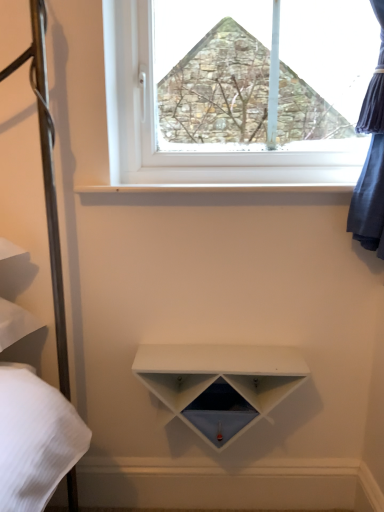
You are a GUI agent. You are given a task and a screenshot of the screen. Output one action in this format:
    pyautogui.click(x=<x>, y=<y>)
    Task: Click on the white plastic window at upper center
    The image size is (384, 512).
    Given the screenshot: What is the action you would take?
    pyautogui.click(x=237, y=90)

Does white smooth shelf at upper center come in front of white plastic window at upper center?

Yes, white smooth shelf at upper center is closer to the viewer.

Considering the relative positions of white smooth shelf at upper center and white plastic window at upper center in the image provided, is white smooth shelf at upper center to the left of white plastic window at upper center from the viewer's perspective?

Yes.

Is point (342, 188) more distant than point (291, 153)?

No.

From the image's perspective, is white smooth shelf at upper center on white plastic window at upper center?

No, from the image's perspective, white smooth shelf at upper center is not above white plastic window at upper center.

Which is more to the right, white matte shelf at center or white smooth shelf at upper center?

Positioned to the right is white smooth shelf at upper center.

This screenshot has width=384, height=512. Find the location of `shelf below the white smooth shelf at upper center (from a real-world perspective)`. shelf below the white smooth shelf at upper center (from a real-world perspective) is located at coordinates (219, 384).

From the image's perspective, between white plastic window at upper center and white matte shelf at center, who is located below?

From the image's view, white matte shelf at center is below.

In terms of height, does white plastic window at upper center look taller or shorter compared to white matte shelf at center?

white plastic window at upper center is taller than white matte shelf at center.

Considering the relative positions of white plastic window at upper center and white matte shelf at center in the image provided, is white plastic window at upper center in front of white matte shelf at center?

No.

At what (x,y) coordinates should I click in order to perform the action: click on shelf in front of the white plastic window at upper center. Please return your answer as a coordinate pair (x, y). The image size is (384, 512). Looking at the image, I should click on (219, 384).

Is white matte shelf at center spatially inside white plastic window at upper center, or outside of it?

white matte shelf at center cannot be found inside white plastic window at upper center.

Is white matte shelf at center to the left of white plastic window at upper center from the viewer's perspective?

Yes.

Is white matte shelf at center in front of or behind white plastic window at upper center in the image?

Clearly, white matte shelf at center is in front of white plastic window at upper center.

From a real-world perspective, is white matte shelf at center below white plastic window at upper center?

Yes, from a real-world perspective, white matte shelf at center is below white plastic window at upper center.

Which object is more forward, white smooth shelf at upper center or white matte shelf at center?

white matte shelf at center.

The width and height of the screenshot is (384, 512). In order to click on shelf located underneath the white smooth shelf at upper center (from a real-world perspective) in this screenshot , I will do `click(219, 384)`.

How much distance is there between white plastic window at upper center and white smooth shelf at upper center?

white plastic window at upper center is 10.82 inches from white smooth shelf at upper center.

Which of these two, white plastic window at upper center or white smooth shelf at upper center, stands taller?

Standing taller between the two is white plastic window at upper center.

From a real-world perspective, between white plastic window at upper center and white smooth shelf at upper center, who is vertically lower?

white smooth shelf at upper center.

Considering the positions of objects white plastic window at upper center and white smooth shelf at upper center in the image provided, who is more to the right, white plastic window at upper center or white smooth shelf at upper center?

white plastic window at upper center is more to the right.

The height and width of the screenshot is (512, 384). What are the coordinates of `window sill in front of the white plastic window at upper center` in the screenshot? It's located at (211, 188).

The height and width of the screenshot is (512, 384). I want to click on window sill located behind the white matte shelf at center, so click(211, 188).

Which object lies further to the anchor point white matte shelf at center, white smooth shelf at upper center or white plastic window at upper center?

Based on the image, white plastic window at upper center appears to be further to white matte shelf at center.

Estimate the real-world distances between objects in this image. Which object is closer to white smooth shelf at upper center, white matte shelf at center or white plastic window at upper center?

white plastic window at upper center lies closer to white smooth shelf at upper center than the other object.

Estimate the real-world distances between objects in this image. Which object is further from white plastic window at upper center, white matte shelf at center or white smooth shelf at upper center?

white matte shelf at center lies further to white plastic window at upper center than the other object.

Estimate the real-world distances between objects in this image. Which object is further from white matte shelf at center, white plastic window at upper center or white smooth shelf at upper center?

white plastic window at upper center is further to white matte shelf at center.

From the image, which object appears to be farther from white plastic window at upper center, white smooth shelf at upper center or white matte shelf at center?

white matte shelf at center is positioned further to the anchor white plastic window at upper center.

Estimate the real-world distances between objects in this image. Which object is closer to white smooth shelf at upper center, white plastic window at upper center or white matte shelf at center?

Based on the image, white plastic window at upper center appears to be nearer to white smooth shelf at upper center.

The image size is (384, 512). Find the location of `window sill between white plastic window at upper center and white matte shelf at center from top to bottom`. window sill between white plastic window at upper center and white matte shelf at center from top to bottom is located at coordinates click(211, 188).